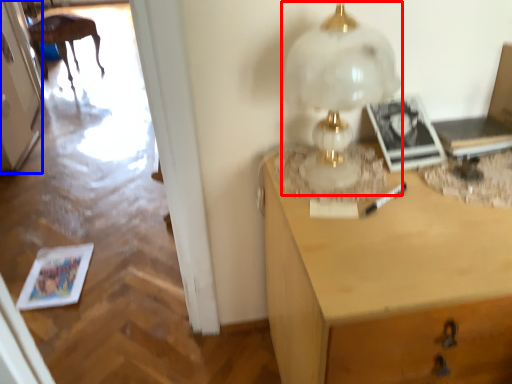
Question: Among these objects, which one is farthest to the camera, table lamp (highlighted by a red box) or door (highlighted by a blue box)?

Choices:
 (A) table lamp
 (B) door

Answer: (B)